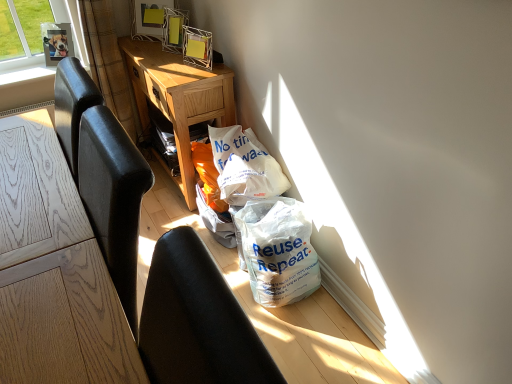
Measure the distance between metallic silver picture frame at upper center, the first picture frame from the right, and camera.

metallic silver picture frame at upper center, the first picture frame from the right, and camera are 2.32 meters apart.

What do you see at coordinates (178, 98) in the screenshot?
I see `light oak desk at center` at bounding box center [178, 98].

The width and height of the screenshot is (512, 384). Find the location of `metallic silver picture frame at upper center, positioned as the second picture frame in left-to-right order`. metallic silver picture frame at upper center, positioned as the second picture frame in left-to-right order is located at coordinates (149, 18).

Is metallic silver picture frame at upper left, acting as the 1th picture frame starting from the left, in front of or behind light wood table at left in the image?

Visually, metallic silver picture frame at upper left, acting as the 1th picture frame starting from the left, is located behind light wood table at left.

From the light wood table at left, count 2nd picture frames backward and point to it. Please provide its 2D coordinates.

[(57, 42)]

From the image's perspective, which one is positioned lower, metallic silver picture frame at upper left, the second picture frame from the right, or light wood table at left?

light wood table at left appears lower in the image.

From a real-world perspective, between metallic silver picture frame at upper left, the second picture frame from the right, and light wood table at left, who is vertically higher?

metallic silver picture frame at upper left, the second picture frame from the right.

Is white plastic bag at center inside brown textured curtain at upper left?

Definitely not — white plastic bag at center is not inside brown textured curtain at upper left.

From a real-world perspective, does brown textured curtain at upper left sit lower than white plastic bag at center?

No.

Which is more to the right, brown textured curtain at upper left or white plastic bag at center?

white plastic bag at center.

From the image's perspective, which one is positioned lower, brown textured curtain at upper left or white plastic bag at center?

white plastic bag at center.

Is metallic silver picture frame at upper center, the first picture frame from the right, far away from white plastic bag at center?

That's not correct — metallic silver picture frame at upper center, the first picture frame from the right, is a little close to white plastic bag at center.

From the image's perspective, is metallic silver picture frame at upper center, the first picture frame from the right, below white plastic bag at center?

Actually, metallic silver picture frame at upper center, the first picture frame from the right, appears above white plastic bag at center in the image.

Considering the relative positions of metallic silver picture frame at upper center, the first picture frame from the right, and white plastic bag at center in the image provided, is metallic silver picture frame at upper center, the first picture frame from the right, to the left of white plastic bag at center from the viewer's perspective?

Yes.

How much distance is there between metallic silver picture frame at upper center, positioned as the second picture frame in left-to-right order, and white plastic bag at center?

95.08 centimeters.

Measure the distance from light wood table at left to black leather chair at lower left.

A distance of 14.84 inches exists between light wood table at left and black leather chair at lower left.

Considering the points (26, 324) and (234, 350), which point is behind, point (26, 324) or point (234, 350)?

The point (26, 324) is behind.

Is light wood table at left aimed at black leather chair at lower left?

No.

From a real-world perspective, is light wood table at left on top of black leather chair at lower left?

No, from a real-world perspective, light wood table at left is not above black leather chair at lower left.

Consider the image. Is light oak desk at center turned away from black leather chair at lower left?

No, light oak desk at center is not facing away from black leather chair at lower left.

Who is more distant, light oak desk at center or black leather chair at lower left?

light oak desk at center.

Is light oak desk at center inside or outside of black leather chair at lower left?

light oak desk at center is not inside black leather chair at lower left, it's outside.

Is light oak desk at center positioned far away from black leather chair at lower left?

Yes.

How many degrees apart are the facing directions of white plastic bag at lower right and light oak desk at center?

The facing directions of white plastic bag at lower right and light oak desk at center are 0.155 degrees apart.

From the picture: Does white plastic bag at lower right have a lesser height compared to light oak desk at center?

Result: Yes, white plastic bag at lower right is shorter than light oak desk at center.

Between white plastic bag at lower right and light oak desk at center, which one appears on the left side from the viewer's perspective?

light oak desk at center is more to the left.

Between light wood table at left and metallic silver picture frame at upper left, the second picture frame from the right, which one has smaller size?

Smaller between the two is metallic silver picture frame at upper left, the second picture frame from the right.

Is metallic silver picture frame at upper left, the second picture frame from the right, located within light wood table at left?

No, metallic silver picture frame at upper left, the second picture frame from the right, is located outside of light wood table at left.

Is light wood table at left in front of or behind metallic silver picture frame at upper left, the second picture frame from the right, in the image?

light wood table at left is positioned closer to the viewer than metallic silver picture frame at upper left, the second picture frame from the right.

Is light wood table at left turned away from metallic silver picture frame at upper left, the second picture frame from the right?

No, light wood table at left's orientation is not away from metallic silver picture frame at upper left, the second picture frame from the right.

Find the location of a particular element. This screenshot has width=512, height=384. the 2nd picture frame behind the light wood table at left is located at coordinates (57, 42).

The width and height of the screenshot is (512, 384). I want to click on grocery bag that is below the brown textured curtain at upper left (from the image's perspective), so click(x=244, y=166).

Which object lies nearer to the anchor point light wood table at left, metallic silver picture frame at upper left, the second picture frame from the right, or white plastic bag at center?

Based on the image, white plastic bag at center appears to be nearer to light wood table at left.

Based on their spatial positions, is light wood table at left or black leather chair at lower left closer to light oak desk at center?

light wood table at left is positioned closer to the anchor light oak desk at center.

From the picture: Which object lies further to the anchor point light oak desk at center, white plastic bag at center or brown textured curtain at upper left?

Among the two, white plastic bag at center is located further to light oak desk at center.

Looking at the image, which one is located closer to metallic silver picture frame at upper center, the first picture frame from the right, metallic silver picture frame at upper left, acting as the 1th picture frame starting from the left, or light oak desk at center?

light oak desk at center is positioned closer to the anchor metallic silver picture frame at upper center, the first picture frame from the right.

From the image, which object appears to be nearer to metallic silver picture frame at upper left, the second picture frame from the right, light wood table at left or metallic silver picture frame at upper center, the first picture frame from the right?

The object closer to metallic silver picture frame at upper left, the second picture frame from the right, is metallic silver picture frame at upper center, the first picture frame from the right.

Estimate the real-world distances between objects in this image. Which object is further from white plastic bag at center, light wood table at left or metallic silver picture frame at upper center, positioned as the second picture frame in left-to-right order?

metallic silver picture frame at upper center, positioned as the second picture frame in left-to-right order, lies further to white plastic bag at center than the other object.

From the image, which object appears to be nearer to black leather chair at lower left, light oak desk at center or brown textured curtain at upper left?

The object closer to black leather chair at lower left is light oak desk at center.

In the scene shown: From the image, which object appears to be farther from black leather chair at lower left, light wood table at left or brown textured curtain at upper left?

brown textured curtain at upper left.

Find the location of a particular element. This screenshot has height=384, width=512. desk between metallic silver picture frame at upper center, the first picture frame from the right, and white plastic bag at center from top to bottom is located at coordinates (178, 98).

At what (x,y) coordinates should I click in order to perform the action: click on curtain situated between metallic silver picture frame at upper left, acting as the 1th picture frame starting from the left, and metallic silver picture frame at upper center, the first picture frame from the right, from left to right. Please return your answer as a coordinate pair (x, y). Looking at the image, I should click on (109, 63).

I want to click on desk between metallic silver picture frame at upper left, the second picture frame from the right, and white plastic bag at lower right from left to right, so click(x=178, y=98).

Where is `desk between metallic silver picture frame at upper center, the first picture frame from the right, and white plastic bag at lower right from top to bottom`? desk between metallic silver picture frame at upper center, the first picture frame from the right, and white plastic bag at lower right from top to bottom is located at coordinates (178, 98).